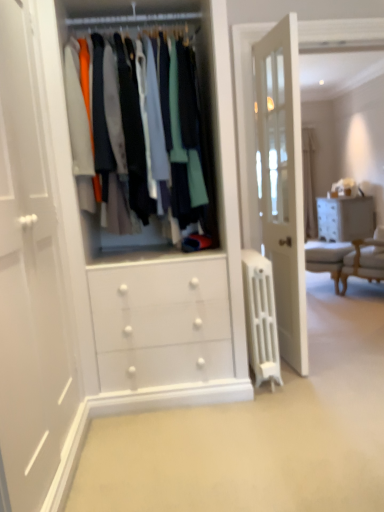
Question: From the image's perspective, relative to white textured chest of drawers at right, is white painted radiator at center above or below?

Choices:
 (A) below
 (B) above

Answer: (A)

Question: In the image, is white painted radiator at center positioned in front of or behind white textured chest of drawers at right?

Choices:
 (A) front
 (B) behind

Answer: (A)

Question: Which of these objects is positioned farthest from the white painted radiator at center?

Choices:
 (A) light beige fabric armchair at right
 (B) matte white clothes at center
 (C) white textured chest of drawers at right

Answer: (C)

Question: Estimate the real-world distances between objects in this image. Which object is closer to the light beige fabric armchair at right?

Choices:
 (A) white textured chest of drawers at right
 (B) matte white clothes at center
 (C) white painted radiator at center

Answer: (A)